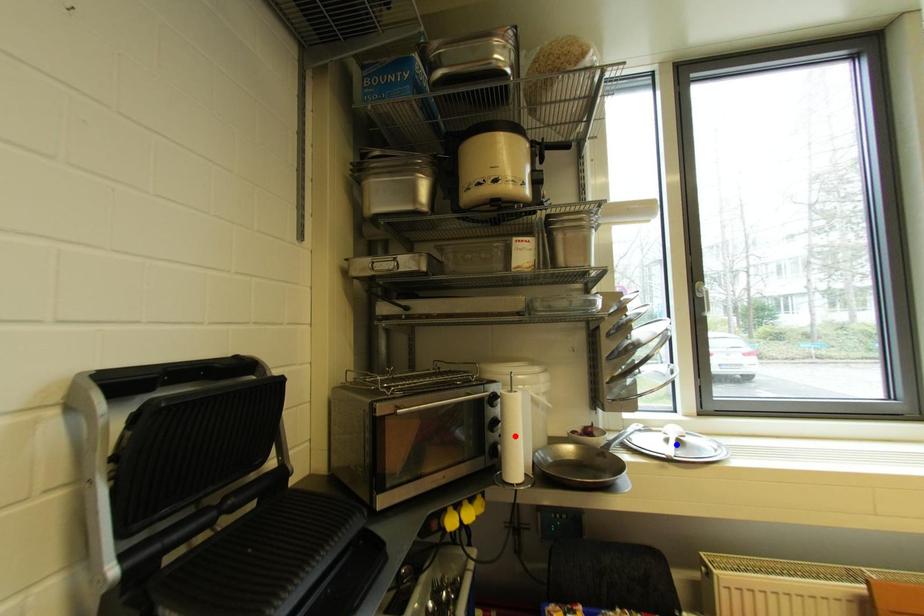
Question: Which of the two points in the image is closer to the camera?

Choices:
 (A) Blue point is closer.
 (B) Red point is closer.

Answer: (B)